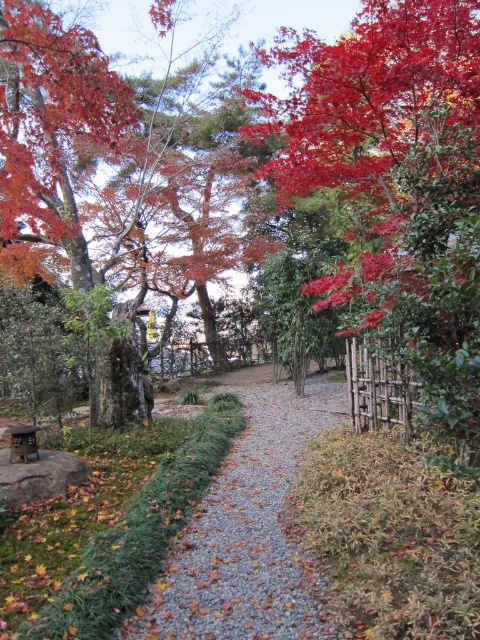
Question: Among these points, which one is nearest to the camera?

Choices:
 (A) pyautogui.click(x=265, y=440)
 (B) pyautogui.click(x=34, y=449)

Answer: (B)

Question: Does gray gravel path at center have a lesser width compared to brown wooden picnic table at lower left?

Choices:
 (A) no
 (B) yes

Answer: (A)

Question: Is the position of gray gravel path at center more distant than that of brown wooden picnic table at lower left?

Choices:
 (A) no
 (B) yes

Answer: (A)

Question: Can you confirm if gray gravel path at center is thinner than brown wooden picnic table at lower left?

Choices:
 (A) yes
 (B) no

Answer: (B)